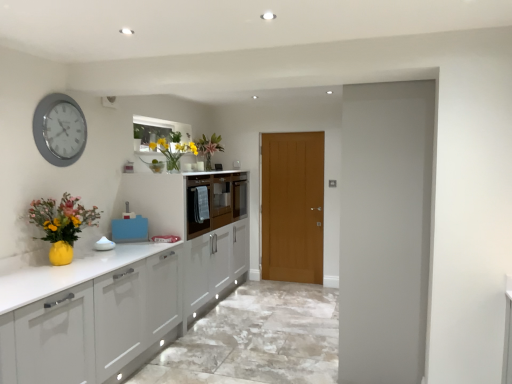
Question: In terms of height, does silver metallic clock at upper left look taller or shorter compared to matte yellow vase at lower left, the first floral arrangement in the front-to-back sequence?

Choices:
 (A) tall
 (B) short

Answer: (A)

Question: Relative to matte yellow vase at lower left, which is counted as the first floral arrangement, starting from the left, is silver metallic clock at upper left in front or behind?

Choices:
 (A) behind
 (B) front

Answer: (A)

Question: Considering the real-world distances, which object is closest to the matte yellow vase at lower left, the 3th floral arrangement in the right-to-left sequence?

Choices:
 (A) silver metallic clock at upper left
 (B) translucent glass vase at upper center, the second floral arrangement from the front
 (C) translucent glass vase at upper center, positioned as the 3th floral arrangement in bottom-to-top order
 (D) matte wood door at center
 (E) matte white cabinetry at center

Answer: (A)

Question: Estimate the real-world distances between objects in this image. Which object is closer to the translucent glass vase at upper center, placed as the third floral arrangement when sorted from front to back?

Choices:
 (A) silver metallic clock at upper left
 (B) matte wood door at center
 (C) blue plastic container at center
 (D) matte white cabinetry at center
 (E) matte yellow vase at lower left, placed as the first floral arrangement when sorted from bottom to top

Answer: (D)